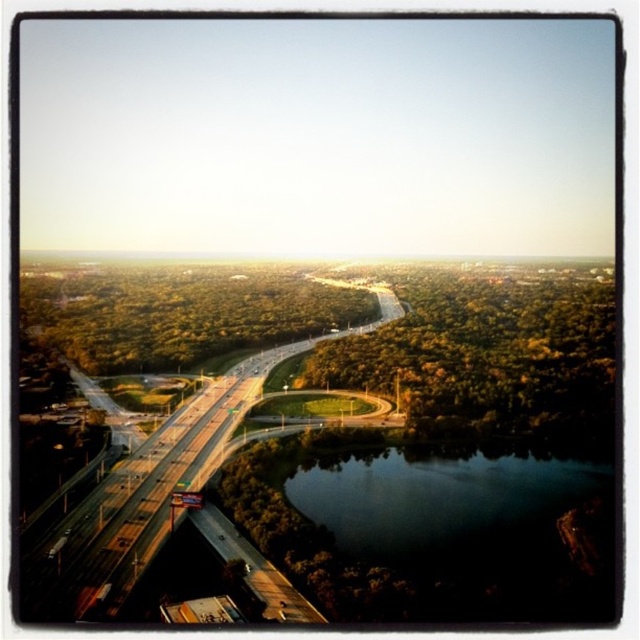
Is dark reflective water at lower center shorter than green asphalt highway at center?

Indeed, dark reflective water at lower center has a lesser height compared to green asphalt highway at center.

Can you confirm if dark reflective water at lower center is positioned to the right of green asphalt highway at center?

Indeed, dark reflective water at lower center is positioned on the right side of green asphalt highway at center.

Where is `dark reflective water at lower center`? The width and height of the screenshot is (640, 640). dark reflective water at lower center is located at coordinates (454, 513).